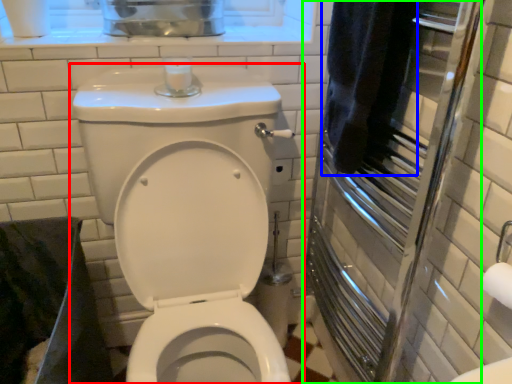
Question: Considering the real-world distances, which object is closest to toilet (highlighted by a red box)? bath towel (highlighted by a blue box) or screen door (highlighted by a green box).

Choices:
 (A) bath towel
 (B) screen door

Answer: (B)